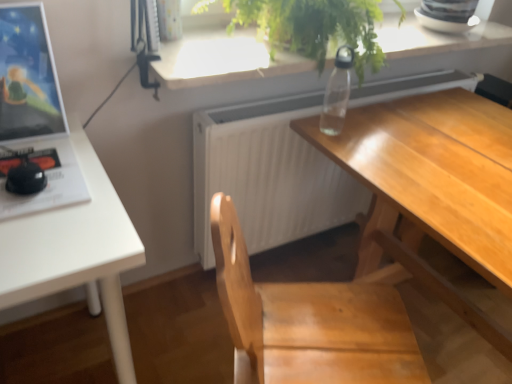
Question: From the image's perspective, is transparent plastic bottle at upper center under white matte radiator at center?

Choices:
 (A) no
 (B) yes

Answer: (A)

Question: Is transparent plastic bottle at upper center shorter than white matte radiator at center?

Choices:
 (A) yes
 (B) no

Answer: (A)

Question: From a real-world perspective, is transparent plastic bottle at upper center physically below white matte radiator at center?

Choices:
 (A) yes
 (B) no

Answer: (B)

Question: Does transparent plastic bottle at upper center have a smaller size compared to white matte radiator at center?

Choices:
 (A) yes
 (B) no

Answer: (A)

Question: From the image's perspective, is transparent plastic bottle at upper center on top of white matte radiator at center?

Choices:
 (A) no
 (B) yes

Answer: (B)

Question: Does transparent plastic bottle at upper center appear on the right side of white matte radiator at center?

Choices:
 (A) yes
 (B) no

Answer: (B)

Question: Does white matte radiator at center lie behind transparent plastic bottle at upper center?

Choices:
 (A) yes
 (B) no

Answer: (A)

Question: Considering the relative sizes of white matte radiator at center and transparent plastic bottle at upper center in the image provided, is white matte radiator at center taller than transparent plastic bottle at upper center?

Choices:
 (A) no
 (B) yes

Answer: (B)

Question: Does white matte radiator at center have a larger size compared to transparent plastic bottle at upper center?

Choices:
 (A) no
 (B) yes

Answer: (B)

Question: From a real-world perspective, is white matte radiator at center located higher than transparent plastic bottle at upper center?

Choices:
 (A) no
 (B) yes

Answer: (A)

Question: Can you confirm if white matte radiator at center is smaller than transparent plastic bottle at upper center?

Choices:
 (A) yes
 (B) no

Answer: (B)

Question: Considering the relative positions of white matte radiator at center and transparent plastic bottle at upper center in the image provided, is white matte radiator at center to the left of transparent plastic bottle at upper center from the viewer's perspective?

Choices:
 (A) no
 (B) yes

Answer: (A)

Question: Can you confirm if white matte radiator at center is bigger than white matte table at left?

Choices:
 (A) yes
 (B) no

Answer: (B)